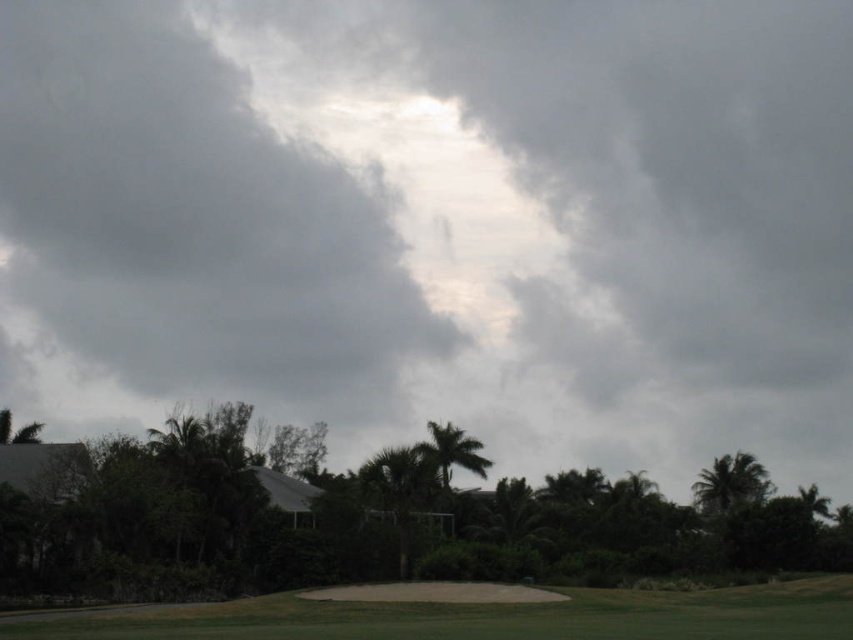
You are standing in the tropical landscape looking at the two green leafy palm trees. Which palm tree is closer to you, the green leafy palm tree at upper right or the green leafy palm tree at center?

The green leafy palm tree at upper right is closer to you because it is further to the viewer than the green leafy palm tree at center.

Based on the photo, you are standing on the sandy brown sand trap at lower center and want to walk to the green leafy palm tree at upper right. Which direction should you face to walk towards it?

You should face upwards and to the right because the green leafy palm tree at upper right is located in that direction relative to the sandy brown sand trap at lower center.

You are a golfer standing on the sandy brown sand trap at lower center and want to hit a ball to the green leafy palm tree at upper right. Considering their heights, will the palm tree be visible from your position?

The sandy brown sand trap at lower center is much taller than the green leafy palm tree at upper right, so the palm tree might be partially or fully obscured from your viewpoint due to the elevation difference.